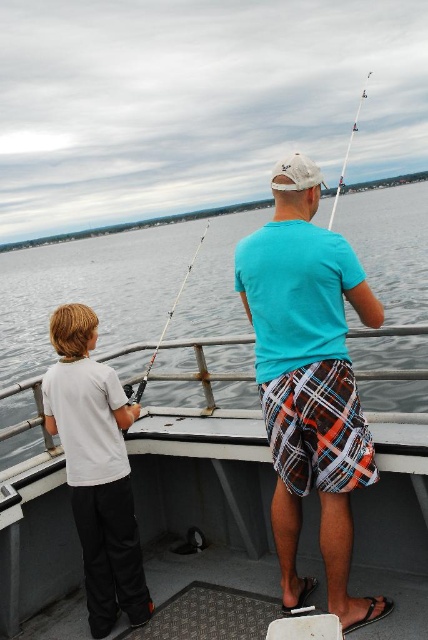
You are on a boat with two people fishing. The child is on the left wearing a white T shirt and dark pants, and the adult is on the right wearing a light blue T shirt and plaid shorts. There is a point at coordinates (89, 291). What is located at that point?

The point at coordinates (89, 291) corresponds to clear water at center.

Consider the image. You are standing on the boat and want to place a small net that is 1 meter wide into the water. The net needs to be placed in an area wider than itself. Can you place it in the clear water at center or the white plastic fishing pole at upper right?

The clear water at center is wider than the white plastic fishing pole at upper right. Since the net is 1 meter wide, you should place it in the clear water at center if its width exceeds 1 meter. However, the provided information doesn